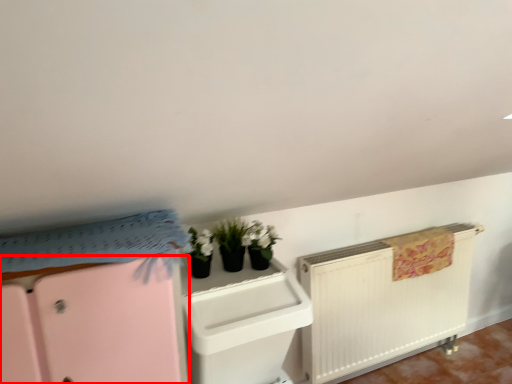
Question: From the image's perspective, where is file cabinet (annotated by the red box) located relative to file cabinet?

Choices:
 (A) below
 (B) above

Answer: (A)